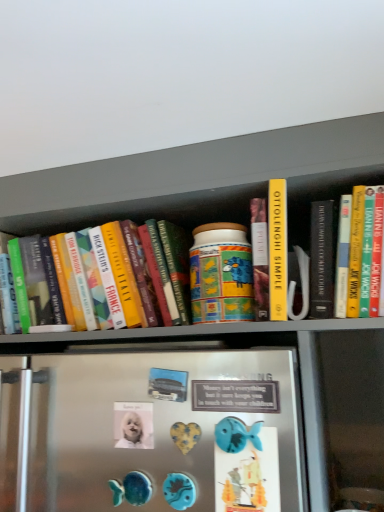
Question: Is blue plastic fish at lower center, which is the second button in back-to-front order, completely or partially inside white glossy button at center, which ranks as the second button in right-to-left order?

Choices:
 (A) yes
 (B) no

Answer: (B)

Question: From a real-world perspective, does white glossy button at center, placed as the 1th button when sorted from back to front, sit lower than blue plastic fish at lower center, the 2th button when ordered from left to right?

Choices:
 (A) yes
 (B) no

Answer: (B)

Question: Considering the relative positions of white glossy button at center, arranged as the 2th button when viewed from the front, and blue plastic fish at lower center, the 2th button when ordered from left to right, in the image provided, is white glossy button at center, arranged as the 2th button when viewed from the front, to the left of blue plastic fish at lower center, the 2th button when ordered from left to right, from the viewer's perspective?

Choices:
 (A) no
 (B) yes

Answer: (B)

Question: Can you confirm if white glossy button at center, which ranks as the second button in right-to-left order, is wider than blue plastic fish at lower center, placed as the 1th button when sorted from right to left?

Choices:
 (A) no
 (B) yes

Answer: (B)

Question: Is white glossy button at center, which ranks as the second button in right-to-left order, aimed at blue plastic fish at lower center, the 2th button when ordered from left to right?

Choices:
 (A) no
 (B) yes

Answer: (A)

Question: Considering the relative sizes of white glossy button at center, which ranks as the first button in left-to-right order, and blue plastic fish at lower center, placed as the 1th button when sorted from right to left, in the image provided, is white glossy button at center, which ranks as the first button in left-to-right order, taller than blue plastic fish at lower center, placed as the 1th button when sorted from right to left,?

Choices:
 (A) yes
 (B) no

Answer: (B)

Question: From the image's perspective, does hardcover book at left appear lower than white glossy button at center, which ranks as the second button in right-to-left order?

Choices:
 (A) no
 (B) yes

Answer: (A)

Question: Is white glossy button at center, which ranks as the first button in left-to-right order, surrounded by hardcover book at left?

Choices:
 (A) yes
 (B) no

Answer: (B)

Question: Is hardcover book at left thinner than white glossy button at center, arranged as the 2th button when viewed from the front?

Choices:
 (A) no
 (B) yes

Answer: (A)

Question: Can you confirm if hardcover book at left is taller than white glossy button at center, which ranks as the second button in right-to-left order?

Choices:
 (A) yes
 (B) no

Answer: (A)

Question: Is hardcover book at left not close to white glossy button at center, placed as the 1th button when sorted from back to front?

Choices:
 (A) yes
 (B) no

Answer: (B)

Question: Is hardcover book at left in front of white glossy button at center, which ranks as the first button in left-to-right order?

Choices:
 (A) yes
 (B) no

Answer: (B)

Question: Is blue plastic fish at lower center, which is the second button in back-to-front order, aimed at white glossy button at center, arranged as the 2th button when viewed from the front?

Choices:
 (A) no
 (B) yes

Answer: (A)